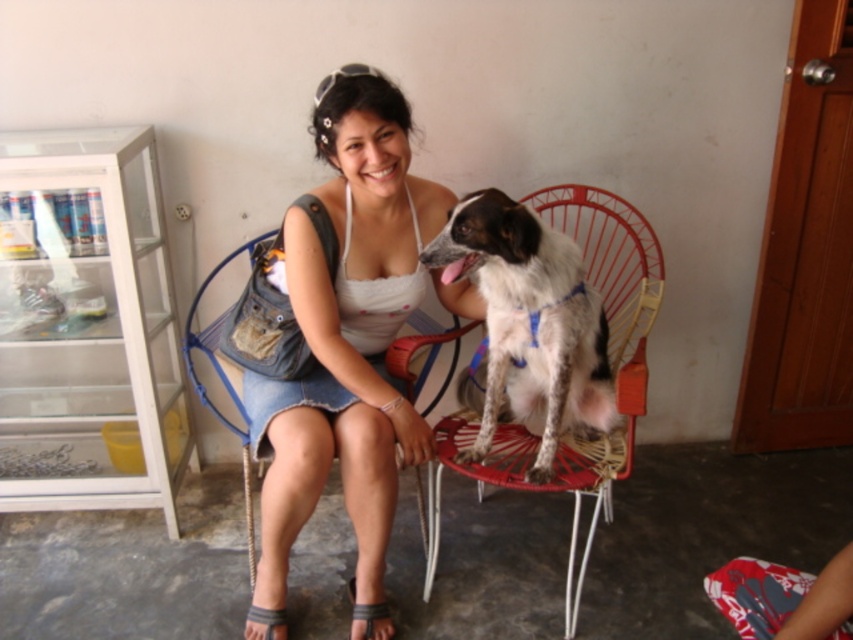
Between white denim skirt at center and blue fabric chair at center, which one has more height?

With more height is white denim skirt at center.

Does point (351, 515) come behind point (218, 340)?

No.

Is point (383, 460) less distant than point (219, 378)?

Yes, it is in front of point (219, 378).

This screenshot has height=640, width=853. In order to click on white denim skirt at center in this screenshot , I will do `click(346, 330)`.

Does point (567, 241) come farther from viewer compared to point (427, 372)?

No.

Is point (593, 291) closer to viewer compared to point (419, 317)?

Yes, it is in front of point (419, 317).

Locate an element on the screen. The width and height of the screenshot is (853, 640). white speckled fur at center is located at coordinates (529, 323).

Is blue fabric chair at center wider than gray fabric sandal at lower left?

Correct, the width of blue fabric chair at center exceeds that of gray fabric sandal at lower left.

Which is above, blue fabric chair at center or gray fabric sandal at lower left?

blue fabric chair at center

I want to click on blue fabric chair at center, so click(x=225, y=380).